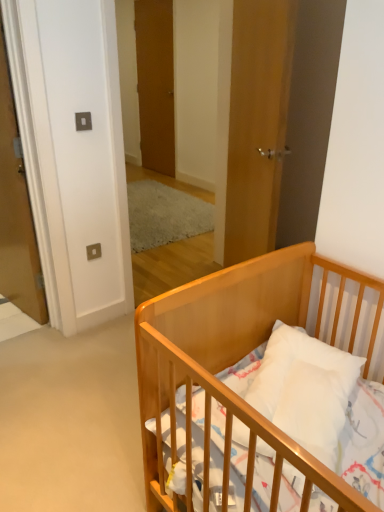
Question: In terms of width, does light wood crib at lower right look wider or thinner when compared to matte wood door at left, the first door positioned from the left?

Choices:
 (A) thin
 (B) wide

Answer: (B)

Question: Based on their positions, is light wood crib at lower right located to the left or right of matte wood door at left, the first door positioned from the left?

Choices:
 (A) right
 (B) left

Answer: (A)

Question: Estimate the real-world distances between objects in this image. Which object is farther from the wooden door at center, the second door from the left?

Choices:
 (A) matte wood door at left, the second door from the front
 (B) light wood crib at lower right
 (C) wooden door at center, the third door from the left

Answer: (B)

Question: Which is farther from the wooden door at center, which is the 2th door from right to left?

Choices:
 (A) light wood crib at lower right
 (B) matte wood door at left, the 3th door in the right-to-left sequence
 (C) wooden door at center, which is counted as the 3th door, starting from the back

Answer: (A)